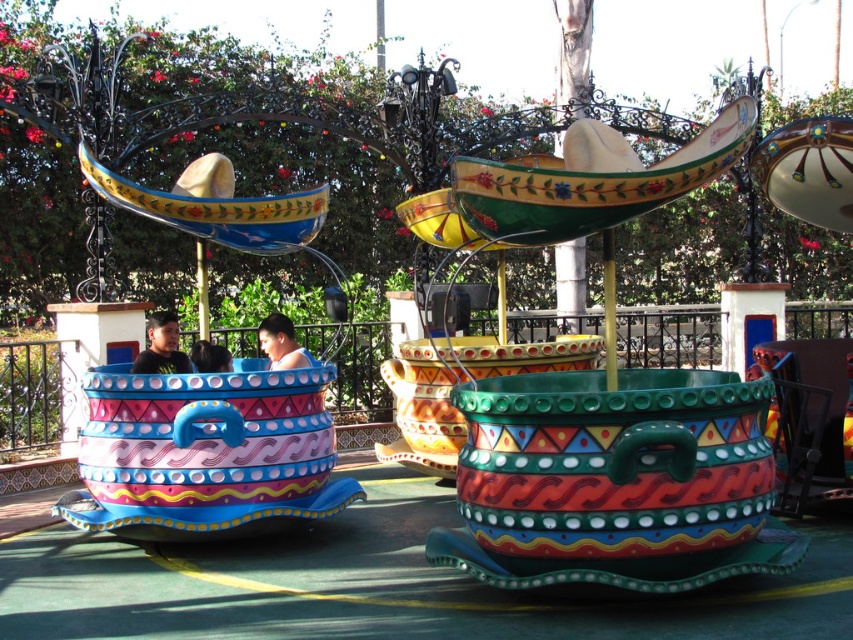
You are a guest at the theme park and want to take a photo of the matte ceramic teacup at center and the matte black shirt at left. Which object should you focus on first if you want to capture both in the same frame without moving the camera?

The matte ceramic teacup at center is located above the matte black shirt at left, so you should focus on the matte black shirt at left first as it is closer to the camera, allowing both objects to be in the frame without moving the camera.

You are designing a new ride safety system that requires knowing the relative sizes of riders to ensure proper seatbelts. You observe two riders in the sombrero carriages. Which rider, the matte black shirt at left or the smooth blue shirt at center, has a smaller body size that might need a shorter seatbelt?

The matte black shirt at left is thinner than the smooth blue shirt at center, so the rider wearing the matte black shirt at left has a smaller body size and might need a shorter seatbelt.